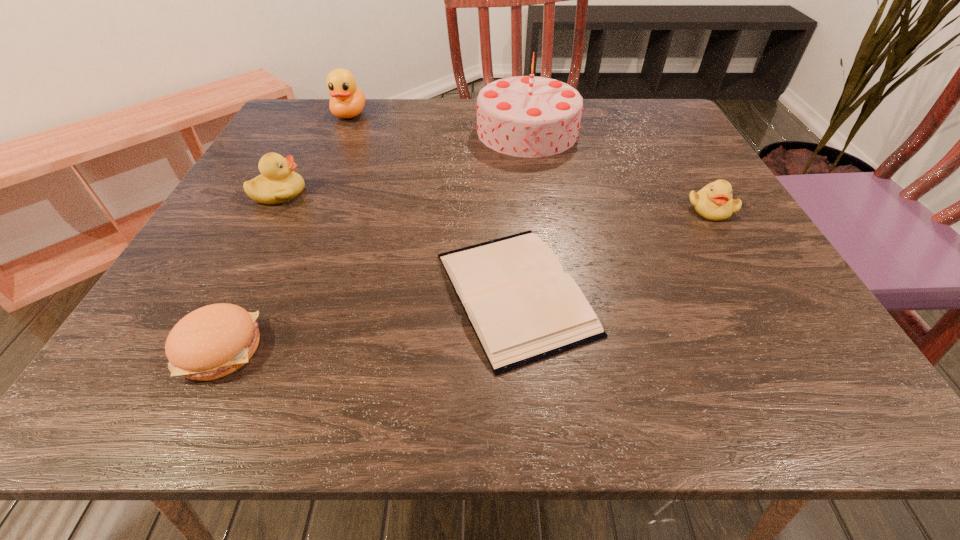
You are a GUI agent. You are given a task and a screenshot of the screen. Output one action in this format:
    pyautogui.click(x=<x>, y=<y>)
    Task: Click on the vacant point located 0.340m on the beak of the second tallest duckling
    The image size is (960, 540).
    Given the screenshot: What is the action you would take?
    pyautogui.click(x=473, y=193)

This screenshot has height=540, width=960. Find the location of `vacant region located 0.350m at the face of the rightmost duckling`. vacant region located 0.350m at the face of the rightmost duckling is located at coordinates (819, 391).

This screenshot has width=960, height=540. What are the coordinates of `free space located 0.250m on the back of the patty` in the screenshot? It's located at (287, 214).

Where is `vacant area situated 0.230m on the left of the hardback book`? The height and width of the screenshot is (540, 960). vacant area situated 0.230m on the left of the hardback book is located at coordinates (290, 293).

Locate an element on the screen. This screenshot has height=540, width=960. birthday cake that is positioned at the far edge is located at coordinates (524, 116).

Locate an element on the screen. duckling present at the far edge is located at coordinates (347, 101).

I want to click on patty that is at the near edge, so click(x=213, y=341).

The height and width of the screenshot is (540, 960). Find the location of `hardback book that is at the near edge`. hardback book that is at the near edge is located at coordinates (523, 308).

The image size is (960, 540). I want to click on patty located in the left edge section of the desktop, so click(x=213, y=341).

The width and height of the screenshot is (960, 540). I want to click on object present at the right edge, so click(x=714, y=202).